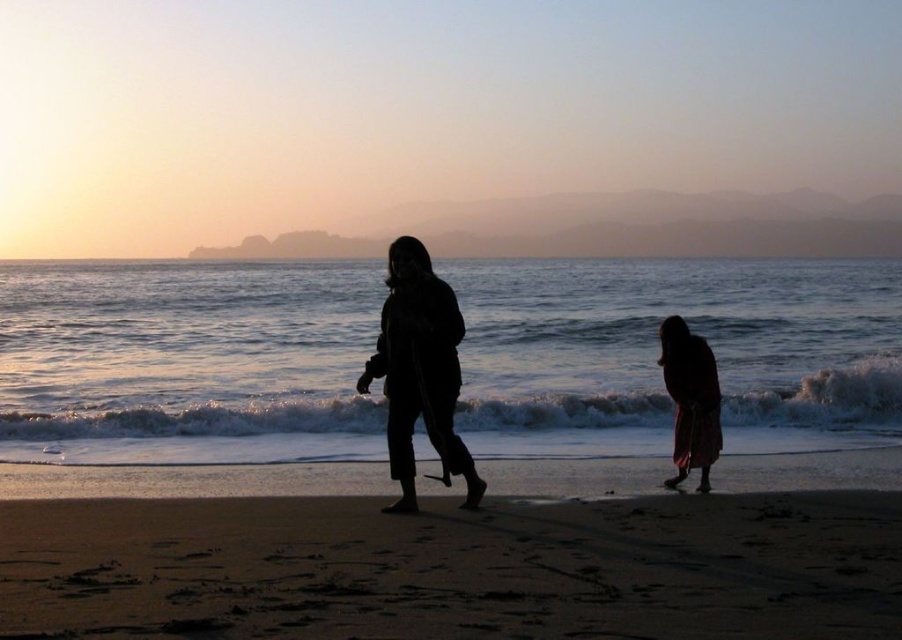
Question: Which of the following is the closest to the observer?

Choices:
 (A) dark sand at lower center
 (B) silhouette fabric at lower right
 (C) silhouette coat at center

Answer: (A)

Question: Which of the following is the farthest from the observer?

Choices:
 (A) silhouette fabric at lower right
 (B) silhouette coat at center

Answer: (A)

Question: Does silhouette coat at center lie behind silhouette fabric at lower right?

Choices:
 (A) yes
 (B) no

Answer: (B)

Question: Can you confirm if silhouette coat at center is positioned below silhouette fabric at lower right?

Choices:
 (A) yes
 (B) no

Answer: (B)

Question: Does dark sand at lower center appear under silhouette fabric at lower right?

Choices:
 (A) no
 (B) yes

Answer: (B)

Question: Among these points, which one is nearest to the camera?

Choices:
 (A) (638, 592)
 (B) (402, 477)
 (C) (698, 467)

Answer: (A)